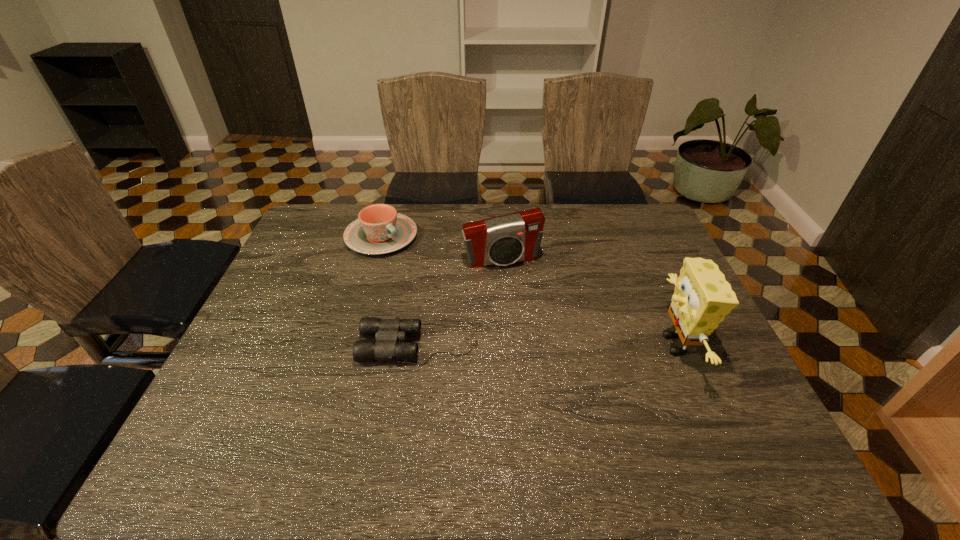
Where is `vacant area that lies between the binoculars and the third shortest object`? The width and height of the screenshot is (960, 540). vacant area that lies between the binoculars and the third shortest object is located at coordinates (461, 302).

The width and height of the screenshot is (960, 540). What are the coordinates of `vacant area that lies between the chinaware and the tallest object` in the screenshot? It's located at (529, 291).

This screenshot has height=540, width=960. What are the coordinates of `free area in between the tallest object and the second shortest object` in the screenshot? It's located at (529, 291).

Image resolution: width=960 pixels, height=540 pixels. I want to click on vacant point located between the shortest object and the camera, so click(461, 302).

I want to click on free spot between the shortest object and the camera, so click(461, 302).

This screenshot has width=960, height=540. I want to click on vacant area between the camera and the shortest object, so click(461, 302).

Find the location of `free area in between the tallest object and the shortest object`. free area in between the tallest object and the shortest object is located at coordinates (548, 344).

This screenshot has width=960, height=540. Find the location of `free space between the chinaware and the second tallest object`. free space between the chinaware and the second tallest object is located at coordinates (442, 248).

Where is `free space between the binoculars and the chinaware`? The height and width of the screenshot is (540, 960). free space between the binoculars and the chinaware is located at coordinates (400, 291).

You are a GUI agent. You are given a task and a screenshot of the screen. Output one action in this format:
    pyautogui.click(x=<x>, y=<y>)
    Task: Click on the object that ranks as the closest to the sponge
    The image size is (960, 540).
    Given the screenshot: What is the action you would take?
    pyautogui.click(x=503, y=240)